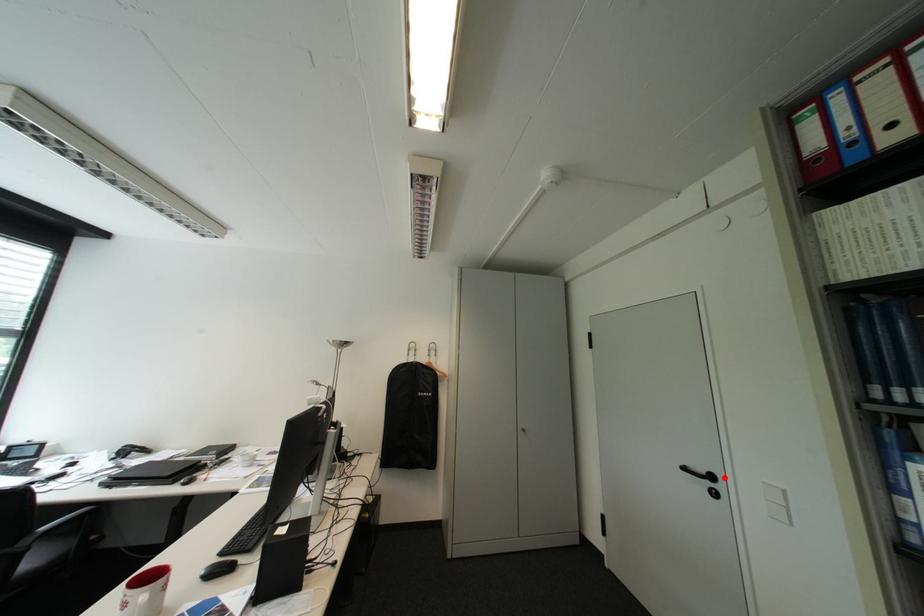
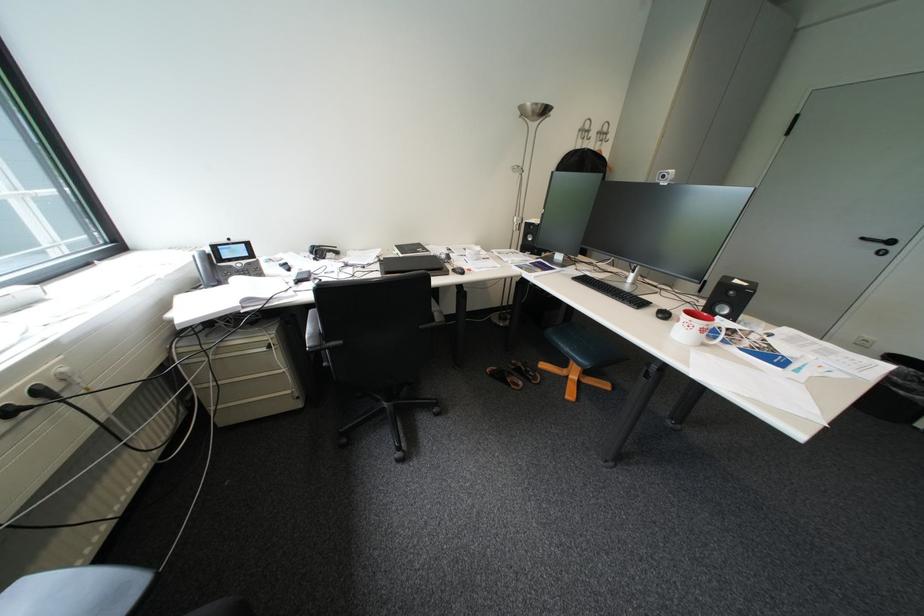
In the second image, find the point that corresponds to the highlighted location in the first image.

(904, 243)